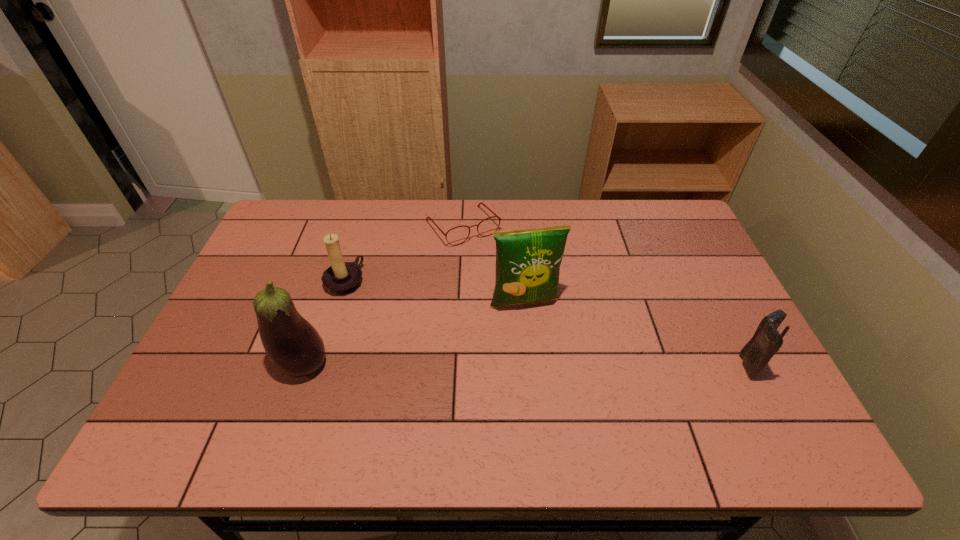
The image size is (960, 540). What are the coordinates of `object that is at the near right corner` in the screenshot? It's located at (766, 341).

Locate an element on the screen. This screenshot has width=960, height=540. free location at the far edge of the desktop is located at coordinates (576, 237).

This screenshot has height=540, width=960. In the image, there is a desktop. In order to click on blank space at the near edge in this screenshot , I will do `click(511, 400)`.

Locate an element on the screen. The image size is (960, 540). vacant space at the left edge of the desktop is located at coordinates (254, 314).

I want to click on free space at the right edge, so click(700, 257).

In the image, there is a desktop. Identify the location of vacant space at the far left corner. The width and height of the screenshot is (960, 540). (285, 225).

In order to click on vacant space at the far right corner in this screenshot , I will do `click(662, 201)`.

Identify the location of vacant area that lies between the shortest object and the candle holder. This screenshot has height=540, width=960. (404, 254).

Identify the location of vacant space in between the candle holder and the cellular telephone. (548, 323).

Where is `vacant area between the eggplant and the crisp (potato chip)`? Image resolution: width=960 pixels, height=540 pixels. vacant area between the eggplant and the crisp (potato chip) is located at coordinates (414, 334).